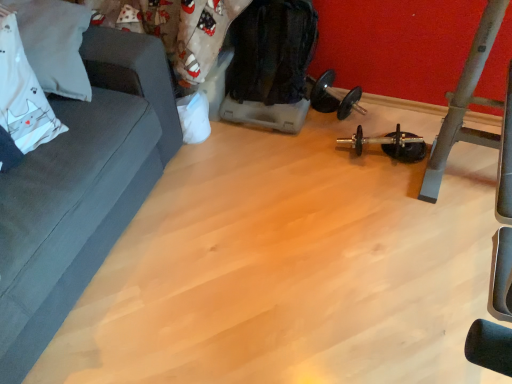
At what (x,y) coordinates should I click in order to perform the action: click on black rubber dumbbell at center. Please return your answer as a coordinate pair (x, y). Image resolution: width=512 pixels, height=384 pixels. Looking at the image, I should click on (390, 144).

Measure the distance between point (x=37, y=358) and camera.

The distance of point (x=37, y=358) from camera is 1.34 meters.

Identify the location of black rubber dumbbell at center. This screenshot has height=384, width=512. (390, 144).

How many degrees apart are the facing directions of black rubber dumbbell at center and white fabric pillow at upper left?

86.5 degrees.

Between black rubber dumbbell at center and white fabric pillow at upper left, which one appears on the left side from the viewer's perspective?

white fabric pillow at upper left.

From a real-world perspective, is black rubber dumbbell at center located beneath white fabric pillow at upper left?

Indeed, from a real-world perspective, black rubber dumbbell at center is positioned beneath white fabric pillow at upper left.

The height and width of the screenshot is (384, 512). There is a black rubber dumbbell at center. In order to click on studio couch above it (from a real-world perspective) in this screenshot , I will do `click(81, 189)`.

Can you confirm if black rubber dumbbell at center is smaller than dark gray fabric couch at left?

Yes.

Are black rubber dumbbell at center and dark gray fabric couch at left far apart?

Yes, black rubber dumbbell at center and dark gray fabric couch at left are located far from each other.

From a real-world perspective, who is located lower, black rubber dumbbell at center or dark gray fabric couch at left?

From a 3D spatial view, black rubber dumbbell at center is below.

Is point (106, 96) closer to camera compared to point (78, 36)?

No, it is not.

Who is shorter, dark gray fabric couch at left or white fabric pillow at upper left?

With less height is white fabric pillow at upper left.

Which object is wider, dark gray fabric couch at left or white fabric pillow at upper left?

dark gray fabric couch at left.

In the image, is dark gray fabric couch at left positioned in front of or behind white fabric pillow at upper left?

dark gray fabric couch at left is in front of white fabric pillow at upper left.

Considering the positions of point (54, 86) and point (54, 139), is point (54, 86) closer or farther from the camera than point (54, 139)?

Point (54, 86) appears to be farther away from the viewer than point (54, 139).

Does white fabric pillow at upper left lie behind dark gray fabric couch at left?

Yes, white fabric pillow at upper left is behind dark gray fabric couch at left.

How many degrees apart are the facing directions of white fabric pillow at upper left and dark gray fabric couch at left?

The facing directions of white fabric pillow at upper left and dark gray fabric couch at left are 2.19 degrees apart.

Are white fabric pillow at upper left and dark gray fabric couch at left making contact?

No, white fabric pillow at upper left is not with dark gray fabric couch at left.

Which of these two, white fabric pillow at upper left or black rubber dumbbell at center, is thinner?

black rubber dumbbell at center is thinner.

Does white fabric pillow at upper left turn towards black rubber dumbbell at center?

Yes, white fabric pillow at upper left is turned towards black rubber dumbbell at center.

Would you say black rubber dumbbell at center is part of white fabric pillow at upper left's contents?

No, black rubber dumbbell at center is not surrounded by white fabric pillow at upper left.

Which is more to the left, white fabric pillow at upper left or black rubber dumbbell at center?

Positioned to the left is white fabric pillow at upper left.

Based on the photo, from a real-world perspective, is dark gray fabric couch at left physically located above or below black rubber dumbbell at center?

dark gray fabric couch at left is situated higher than black rubber dumbbell at center in the real world.

Considering the sizes of dark gray fabric couch at left and black rubber dumbbell at center in the image, is dark gray fabric couch at left taller or shorter than black rubber dumbbell at center?

dark gray fabric couch at left is taller than black rubber dumbbell at center.

From the image's perspective, which one is positioned lower, dark gray fabric couch at left or black rubber dumbbell at center?

dark gray fabric couch at left appears lower in the image.

Image resolution: width=512 pixels, height=384 pixels. In the image, there is a white fabric pillow at upper left. What are the coordinates of `equipment below it (from the image's perspective)` in the screenshot? It's located at (390, 144).

At what (x,y) coordinates should I click in order to perform the action: click on studio couch above the black rubber dumbbell at center (from a real-world perspective). Please return your answer as a coordinate pair (x, y). The width and height of the screenshot is (512, 384). Looking at the image, I should click on (81, 189).

Estimate the real-world distances between objects in this image. Which object is further from white fabric pillow at upper left, dark gray fabric couch at left or black rubber dumbbell at center?

The object further to white fabric pillow at upper left is black rubber dumbbell at center.

Which object lies further to the anchor point dark gray fabric couch at left, black rubber dumbbell at center or white fabric pillow at upper left?

black rubber dumbbell at center.

Looking at the image, which one is located further to dark gray fabric couch at left, white fabric pillow at upper left or black rubber dumbbell at center?

The object further to dark gray fabric couch at left is black rubber dumbbell at center.

Considering their positions, is black rubber dumbbell at center positioned closer to white fabric pillow at upper left than dark gray fabric couch at left?

dark gray fabric couch at left is positioned closer to the anchor white fabric pillow at upper left.

Estimate the real-world distances between objects in this image. Which object is closer to black rubber dumbbell at center, dark gray fabric couch at left or white fabric pillow at upper left?

Among the two, dark gray fabric couch at left is located nearer to black rubber dumbbell at center.

From the image, which object appears to be nearer to black rubber dumbbell at center, white fabric pillow at upper left or dark gray fabric couch at left?

dark gray fabric couch at left is positioned closer to the anchor black rubber dumbbell at center.

This screenshot has width=512, height=384. I want to click on pillow situated between dark gray fabric couch at left and black rubber dumbbell at center from left to right, so click(x=54, y=44).